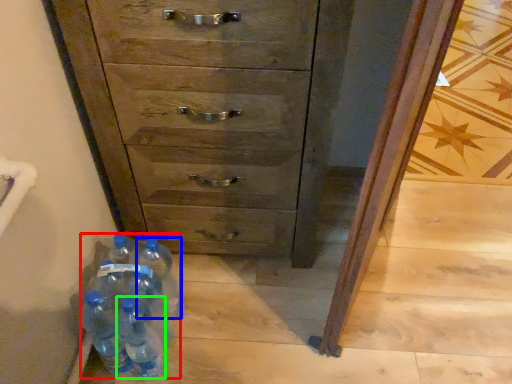
Question: Considering the real-world distances, which object is closest to bottle (highlighted by a red box)? bottle (highlighted by a blue box) or bottle (highlighted by a green box).

Choices:
 (A) bottle
 (B) bottle

Answer: (B)